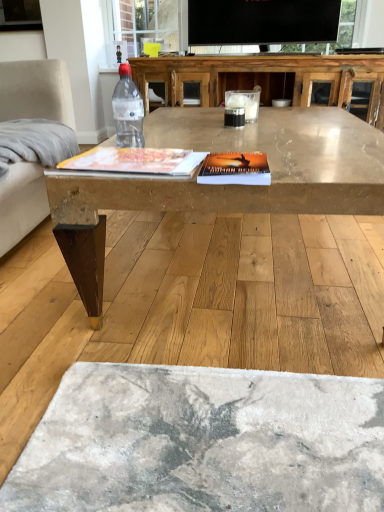
Question: Is light gray fabric armchair at left bigger or smaller than clear glass table at center?

Choices:
 (A) big
 (B) small

Answer: (B)

Question: Would you say light gray fabric armchair at left is to the left or to the right of clear glass table at center in the picture?

Choices:
 (A) left
 (B) right

Answer: (A)

Question: Which is farther from the transparent plastic bottle at center?

Choices:
 (A) clear glass table at center
 (B) light gray fabric armchair at left
 (C) matte wooden coffee table at center

Answer: (C)

Question: Which object is positioned farthest from the matte wooden coffee table at center?

Choices:
 (A) transparent plastic bottle at center
 (B) light gray fabric armchair at left
 (C) clear glass table at center

Answer: (A)